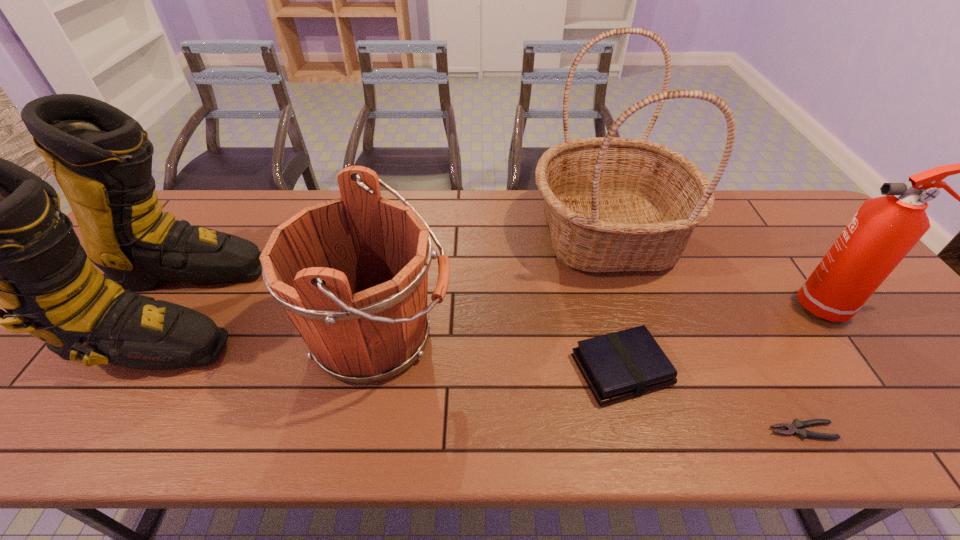
I want to click on pliers positioned at the near edge, so click(x=795, y=428).

Find the location of a particular element. This screenshot has width=960, height=540. object located at the left edge is located at coordinates (0, 234).

I want to click on object positioned at the right edge, so click(x=883, y=231).

Locate an element on the screen. The width and height of the screenshot is (960, 540). free space at the far edge of the desktop is located at coordinates click(244, 215).

In the image, there is a desktop. Where is `vacant area at the near edge`? This screenshot has width=960, height=540. vacant area at the near edge is located at coordinates (433, 446).

The width and height of the screenshot is (960, 540). What are the coordinates of `vacant space at the right edge of the desktop` in the screenshot? It's located at (901, 336).

The height and width of the screenshot is (540, 960). Identify the location of free space at the far left corner of the desktop. (186, 214).

Where is `vacant space at the far right corner of the desktop`? Image resolution: width=960 pixels, height=540 pixels. vacant space at the far right corner of the desktop is located at coordinates (815, 225).

Identify the location of vacant area that lies between the rightmost object and the fifth tallest object. The image size is (960, 540). (727, 338).

You are a GUI agent. You are given a task and a screenshot of the screen. Output one action in this format:
    pyautogui.click(x=<x>, y=<y>)
    Task: Click on the free spot between the shortest object and the basket
    
    Given the screenshot: What is the action you would take?
    pyautogui.click(x=705, y=333)